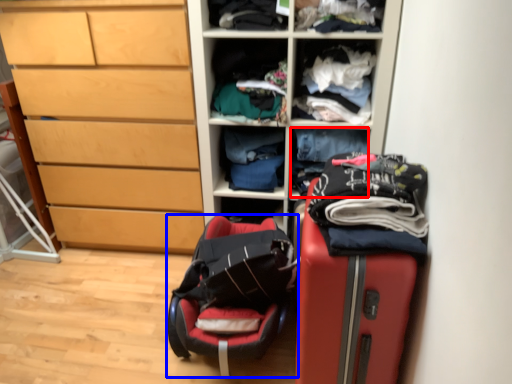
Question: Which of the following is the closest to the observer, clothing (highlighted by a red box) or luggage (highlighted by a blue box)?

Choices:
 (A) clothing
 (B) luggage

Answer: (B)